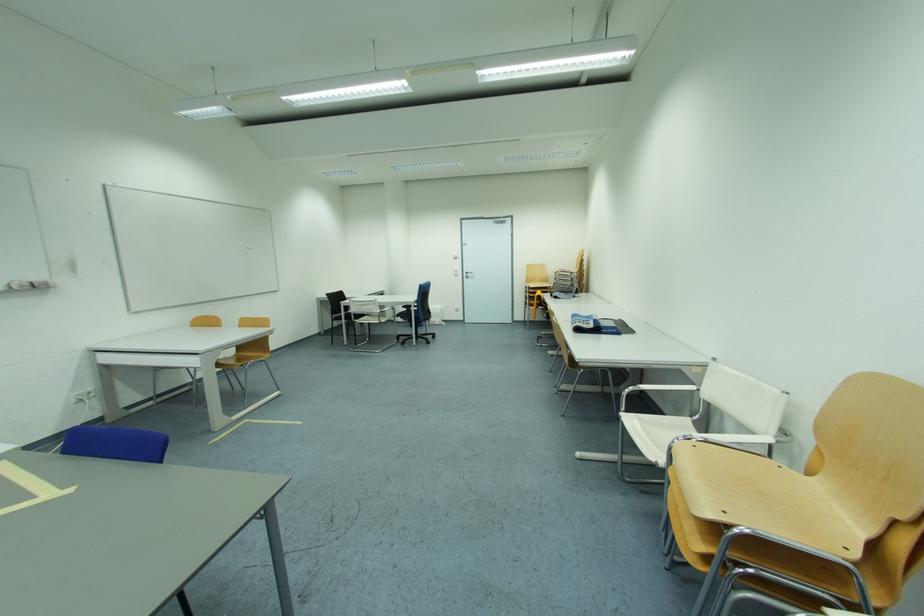
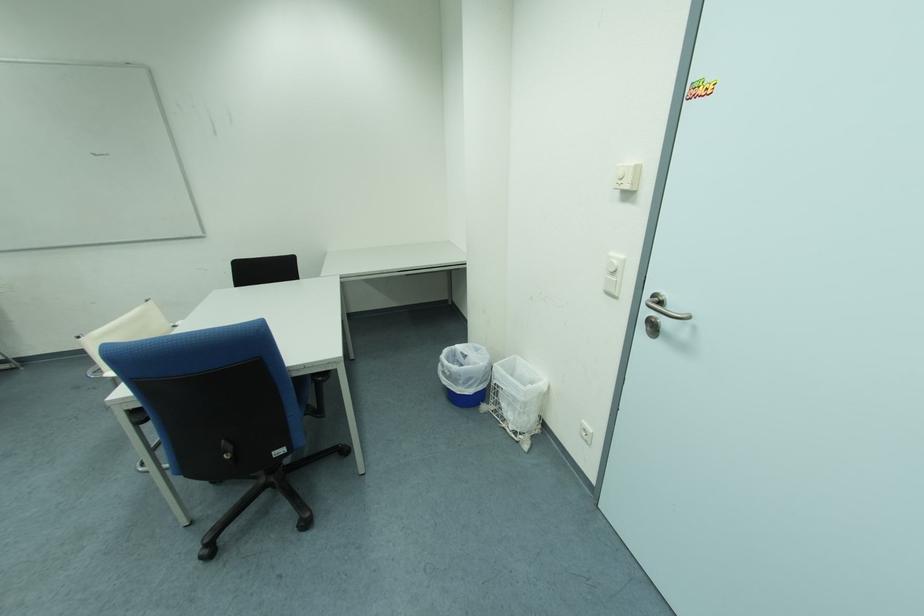
Where in the second image is the point corresponding to (x=465, y=278) from the first image?

(616, 296)